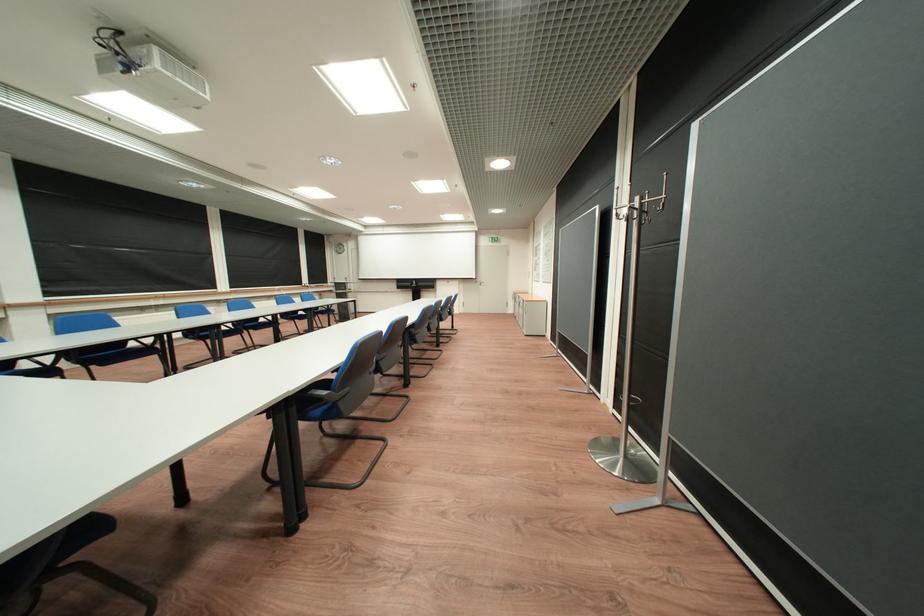
In order to click on white door handle in this screenshot , I will do `click(484, 286)`.